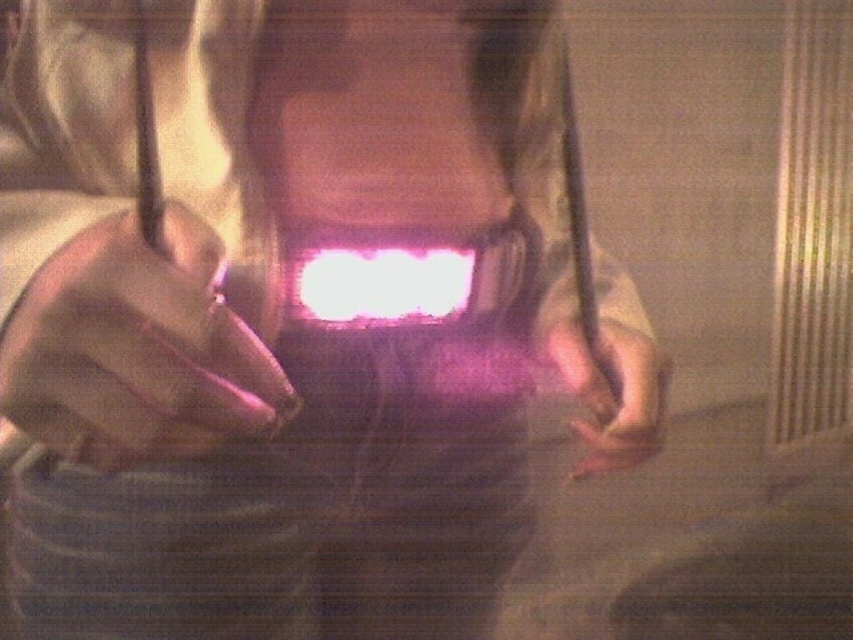
You are a safety inspector checking the equipment in the scene. The point at coordinates (135, 349) is marked as a critical inspection point. What object is located at this point?

The point at coordinates (135, 349) marks the matte purple glove at center.

You are a photographer trying to capture the reflection of the bright white light on the helmet visor. The camera you are using has a focus point at coordinate point (380, 284). Will this focus point align with the bright white light at center?

The bright white light at center is represented by point (380, 284), so yes, the focus point at coordinate point (380, 284) will align with the bright white light at center.

You are a safety inspector checking the equipment in the image. You notice the matte purple glove at center and the pink matte hand at lower right. Which object is positioned higher in the image?

The matte purple glove at center is much taller than the pink matte hand at lower right, so the matte purple glove at center is positioned higher in the image.